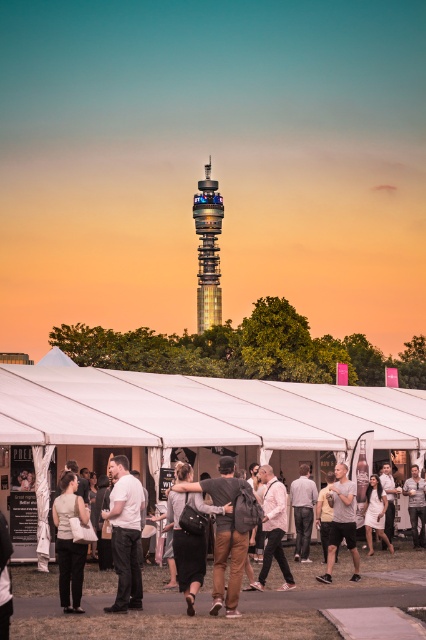
From the picture: You are a fashion designer observing a model wearing the matte black pants at center and dark gray cotton shirt at center. Which clothing item is shorter in height?

The matte black pants at center is not as tall as dark gray cotton shirt at center, so the matte black pants at center is shorter in height.

You are attending an event at the base of the Swiss Re Building and see both the matte black pants at center and the dark gray cotton shirt at center. Which clothing item is positioned to the left?

The matte black pants at center is positioned to the left of the dark gray cotton shirt at center.

You are a photographer positioned at the base of the Swiss Re Building. You want to take a photo of both the dark gray cotton shirt at center and the pink matte shirt at center in the foreground tents. How far apart are these two shirts from each other?

The distance between the dark gray cotton shirt at center and the pink matte shirt at center is 13.49 meters.